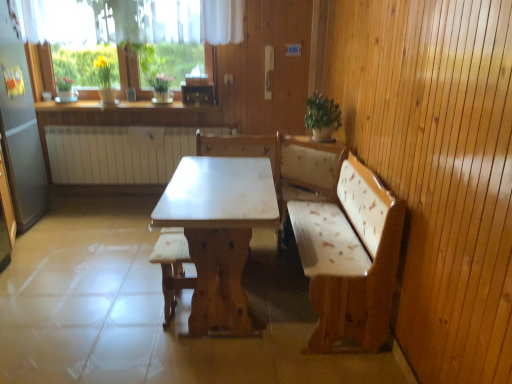
What do you see at coordinates (322, 117) in the screenshot? The image size is (512, 384). I see `green leafy plant at upper center` at bounding box center [322, 117].

This screenshot has height=384, width=512. What do you see at coordinates (103, 71) in the screenshot?
I see `green matte plant at upper left, which is the 1th plant from left to right` at bounding box center [103, 71].

Find the location of a particular element. white glossy counter top at upper center is located at coordinates (121, 107).

Is white marble table at center turned away from green glossy vase at upper center, which is the 1th plant from right to left?

No, white marble table at center's orientation is not away from green glossy vase at upper center, which is the 1th plant from right to left.

Considering the sizes of objects white marble table at center and green glossy vase at upper center, placed as the second plant when sorted from left to right, in the image provided, who is thinner, white marble table at center or green glossy vase at upper center, placed as the second plant when sorted from left to right,?

Thinner between the two is green glossy vase at upper center, placed as the second plant when sorted from left to right.

From a real-world perspective, which object stands above the other?

From a 3D spatial view, green glossy vase at upper center, placed as the second plant when sorted from left to right, is above.

From the image's perspective, is green glossy vase at upper center, which is the 1th plant from right to left, below white fabric cushion at center?

No.

Does green glossy vase at upper center, which is the 1th plant from right to left, come behind white fabric cushion at center?

Yes, green glossy vase at upper center, which is the 1th plant from right to left, is further from the camera.

Is green glossy vase at upper center, which is the 1th plant from right to left, at the left side of white fabric cushion at center?

Yes.

Can you confirm if green glossy vase at upper center, placed as the second plant when sorted from left to right, is taller than light brown wood table at center?

Incorrect, the height of green glossy vase at upper center, placed as the second plant when sorted from left to right, is not larger of that of light brown wood table at center.

From the image's perspective, relative to light brown wood table at center, is green glossy vase at upper center, which is the 1th plant from right to left, above or below?

Clearly, from the image's perspective, green glossy vase at upper center, which is the 1th plant from right to left, is above light brown wood table at center.

Which object is more forward, green glossy vase at upper center, which is the 1th plant from right to left, or light brown wood table at center?

light brown wood table at center.

Does point (194, 63) come behind point (321, 291)?

Yes, it is behind point (321, 291).

Between light brown wood table at center and white marble table at center, which one appears on the left side from the viewer's perspective?

Positioned to the left is white marble table at center.

Which is behind, point (357, 226) or point (224, 230)?

The point (357, 226) is behind.

Can you confirm if light brown wood table at center is bigger than white marble table at center?

Yes.

From the image's perspective, is light brown wood table at center on white marble table at center?

Indeed, from the image's perspective, light brown wood table at center is shown above white marble table at center.

At what (x,y) coordinates should I click in order to perform the action: click on houseplant behind the white fabric cushion at center. Please return your answer as a coordinate pair (x, y). This screenshot has height=384, width=512. Looking at the image, I should click on (322, 117).

Does white fabric cushion at center have a smaller size compared to green leafy plant at upper center?

No, white fabric cushion at center is not smaller than green leafy plant at upper center.

Is the depth of white fabric cushion at center greater than that of green leafy plant at upper center?

No, white fabric cushion at center is closer to the camera.

Based on their positions, is white fabric cushion at center located to the left or right of green leafy plant at upper center?

white fabric cushion at center is to the left of green leafy plant at upper center.

Is green matte plant at upper left, which is the 1th plant from left to right, at the right side of white glossy counter top at upper center?

No, green matte plant at upper left, which is the 1th plant from left to right, is not to the right of white glossy counter top at upper center.

Does point (100, 64) come behind point (170, 108)?

Yes, point (100, 64) is farther from viewer.

Which of these two, green matte plant at upper left, which is the 1th plant from left to right, or white glossy counter top at upper center, is bigger?

With larger size is white glossy counter top at upper center.

Looking at this image, from a real-world perspective, who is located higher, white fabric cushion at center or white marble table at center?

In real-world perspective, white marble table at center is above.

Is white fabric cushion at center turned away from white marble table at center?

Yes, white fabric cushion at center is facing away from white marble table at center.

Locate an element on the screen. The height and width of the screenshot is (384, 512). table above the white fabric cushion at center (from the image's perspective) is located at coordinates (219, 232).

Visually, is white fabric cushion at center positioned to the left or to the right of white marble table at center?

white fabric cushion at center is positioned on white marble table at center's left side.

Where is `the 2nd plant directly above the white marble table at center (from a real-world perspective)`? The image size is (512, 384). the 2nd plant directly above the white marble table at center (from a real-world perspective) is located at coordinates (84, 64).

Image resolution: width=512 pixels, height=384 pixels. What are the coordinates of `armchair that appears on the right of green glossy vase at upper center, placed as the second plant when sorted from left to right` in the screenshot? It's located at (172, 268).

Considering their positions, is green glossy vase at upper center, which is the 1th plant from right to left, positioned further to white glossy counter top at upper center than green leafy plant at upper center?

green leafy plant at upper center is positioned further to the anchor white glossy counter top at upper center.

Looking at the image, which one is located closer to green leafy plant at upper center, white fabric cushion at center or white marble table at center?

white marble table at center is positioned closer to the anchor green leafy plant at upper center.

From the image, which object appears to be nearer to white glossy counter top at upper center, green leafy plant at upper center or white marble table at center?

green leafy plant at upper center lies closer to white glossy counter top at upper center than the other object.

Estimate the real-world distances between objects in this image. Which object is closer to light brown wood table at center, green glossy vase at upper center, placed as the second plant when sorted from left to right, or white glossy counter top at upper center?

Based on the image, white glossy counter top at upper center appears to be nearer to light brown wood table at center.

Looking at the image, which one is located closer to green matte plant at upper left, arranged as the 2th plant when viewed from the right, white fabric cushion at center or white marble table at center?

Based on the image, white fabric cushion at center appears to be nearer to green matte plant at upper left, arranged as the 2th plant when viewed from the right.

When comparing their distances from green matte plant at upper left, which is the 1th plant from left to right, does green glossy vase at upper center, placed as the second plant when sorted from left to right, or white glossy counter top at upper center seem further?

white glossy counter top at upper center.

From the image, which object appears to be nearer to white marble table at center, green leafy plant at upper center or green glossy vase at upper center, placed as the second plant when sorted from left to right?

green leafy plant at upper center is positioned closer to the anchor white marble table at center.

In the scene shown: Considering their positions, is white marble table at center positioned further to green leafy plant at upper center than green glossy vase at upper center, which is the 1th plant from right to left?

Based on the image, green glossy vase at upper center, which is the 1th plant from right to left, appears to be further to green leafy plant at upper center.

Where is `plant between green matte plant at upper left, arranged as the 2th plant when viewed from the right, and green leafy plant at upper center`? plant between green matte plant at upper left, arranged as the 2th plant when viewed from the right, and green leafy plant at upper center is located at coordinates (84, 64).

You are a GUI agent. You are given a task and a screenshot of the screen. Output one action in this format:
    pyautogui.click(x=<x>, y=<y>)
    Task: Click on the houseplant located between white fabric cushion at center and green glossy vase at upper center, which is the 1th plant from right to left, in the depth direction
    The width and height of the screenshot is (512, 384).
    Given the screenshot: What is the action you would take?
    pyautogui.click(x=322, y=117)

I want to click on plant between white marble table at center and white glossy counter top at upper center along the z-axis, so click(x=103, y=71).

I want to click on furniture between green leafy plant at upper center and white fabric cushion at center in the up-down direction, so click(x=333, y=233).